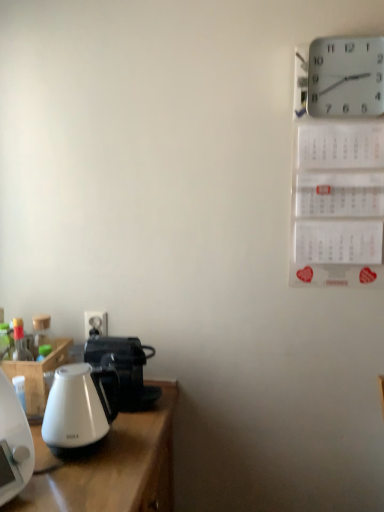
Question: Does white plastic electric outlet at lower left have a lesser height compared to white glossy kettle at left?

Choices:
 (A) no
 (B) yes

Answer: (B)

Question: Are white plastic electric outlet at lower left and white glossy kettle at left located far from each other?

Choices:
 (A) no
 (B) yes

Answer: (A)

Question: Considering the relative sizes of white plastic electric outlet at lower left and white glossy kettle at left in the image provided, is white plastic electric outlet at lower left smaller than white glossy kettle at left?

Choices:
 (A) no
 (B) yes

Answer: (B)

Question: From a real-world perspective, is white plastic electric outlet at lower left beneath white glossy kettle at left?

Choices:
 (A) no
 (B) yes

Answer: (A)

Question: Does white plastic electric outlet at lower left lie in front of white glossy kettle at left?

Choices:
 (A) yes
 (B) no

Answer: (B)

Question: Do you think white glossy kettle at left is within white plastic wall clock at upper right, or outside of it?

Choices:
 (A) outside
 (B) inside

Answer: (A)

Question: Relative to white plastic wall clock at upper right, is white glossy kettle at left in front or behind?

Choices:
 (A) behind
 (B) front

Answer: (B)

Question: From their relative heights in the image, would you say white glossy kettle at left is taller or shorter than white plastic wall clock at upper right?

Choices:
 (A) short
 (B) tall

Answer: (A)

Question: Considering the relative positions of white glossy kettle at left and white plastic wall clock at upper right in the image provided, is white glossy kettle at left to the left or to the right of white plastic wall clock at upper right?

Choices:
 (A) right
 (B) left

Answer: (B)

Question: In terms of width, does white plastic electric outlet at lower left look wider or thinner when compared to white glossy coffee pot at lower left?

Choices:
 (A) wide
 (B) thin

Answer: (B)

Question: Is white plastic electric outlet at lower left in front of or behind white glossy coffee pot at lower left in the image?

Choices:
 (A) behind
 (B) front

Answer: (A)

Question: From the image's perspective, is white plastic electric outlet at lower left above or below white glossy coffee pot at lower left?

Choices:
 (A) below
 (B) above

Answer: (B)

Question: Is white plastic electric outlet at lower left inside or outside of white glossy coffee pot at lower left?

Choices:
 (A) inside
 (B) outside

Answer: (B)

Question: From a real-world perspective, is white glossy coffee pot at lower left positioned above or below white plastic wall clock at upper right?

Choices:
 (A) above
 (B) below

Answer: (B)

Question: Is white glossy coffee pot at lower left bigger or smaller than white plastic wall clock at upper right?

Choices:
 (A) small
 (B) big

Answer: (B)